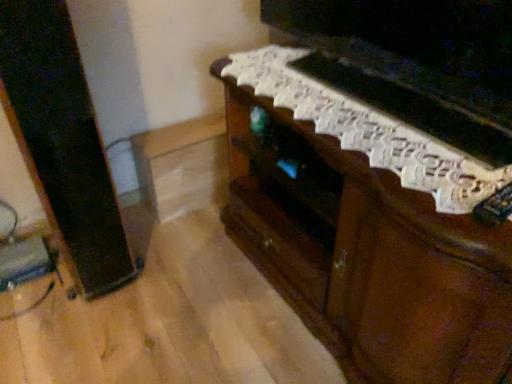
The height and width of the screenshot is (384, 512). Describe the element at coordinates (382, 181) in the screenshot. I see `brown wooden tv stand at center` at that location.

In order to face brown wooden tv stand at center, should I rotate leftwards or rightwards?

To align with it, rotate right about 16.735°.

Locate an element on the screen. brown wooden tv stand at center is located at coordinates (382, 181).

Identify the location of brown wooden tv stand at center. (382, 181).